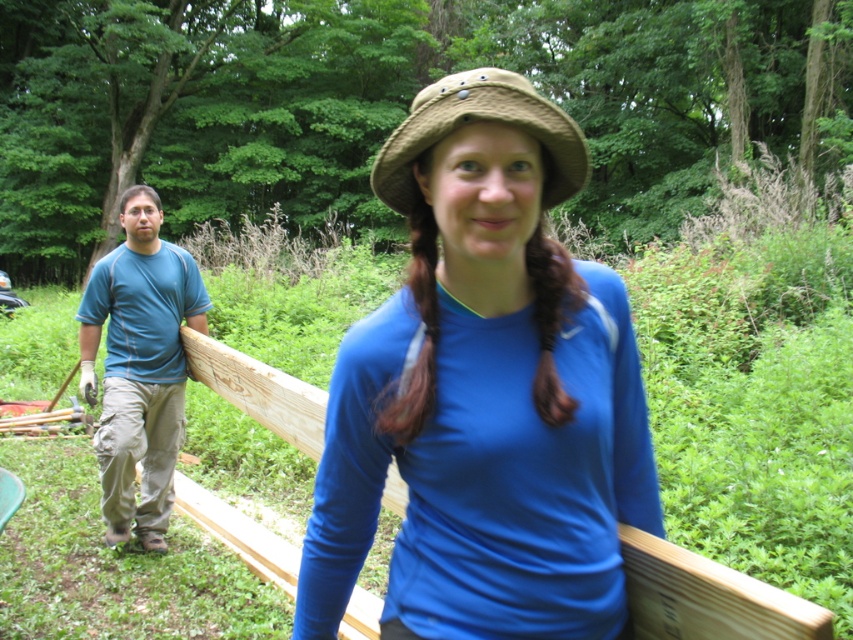
Question: Does blue matte shirt at center have a smaller size compared to blue cotton shirt at left?

Choices:
 (A) no
 (B) yes

Answer: (B)

Question: From the image, what is the correct spatial relationship of blue cotton shirt at left in relation to tan woven straw hat at center?

Choices:
 (A) above
 (B) below

Answer: (B)

Question: Can you confirm if blue matte shirt at center is wider than brown wood fence at left?

Choices:
 (A) no
 (B) yes

Answer: (A)

Question: Which point is farther to the camera?

Choices:
 (A) (396, 509)
 (B) (576, 152)
 (C) (447, 76)
 (D) (171, 484)

Answer: (C)

Question: Which object is positioned closest to the blue matte shirt at center?

Choices:
 (A) brown wood fence at left
 (B) tan woven straw hat at center

Answer: (B)

Question: Based on their relative distances, which object is farther from the tan woven straw hat at center?

Choices:
 (A) blue matte shirt at center
 (B) blue cotton shirt at left

Answer: (B)